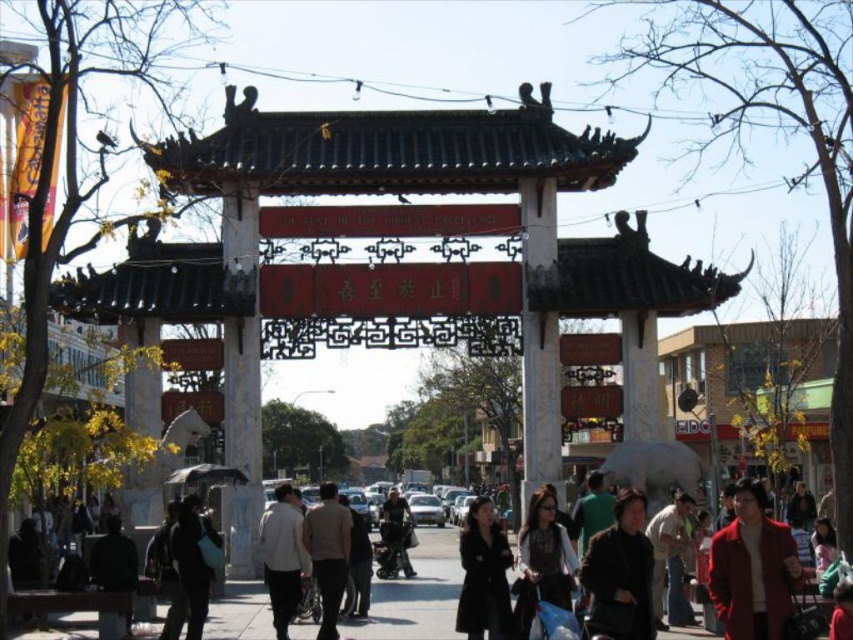
You are standing at the origin point of the scene. Where is the dark gray coat at center located in terms of coordinates?

The dark gray coat at center is located at coordinates point (189, 570).

You are a delivery person carrying a package and need to place it on the black matte coat at center. However, there is a dark gray fabric stroller at center in the way. Can you place the package on the coat without moving the stroller?

The black matte coat at center is located below the dark gray fabric stroller at center, so the stroller is blocking access to the coat. You cannot place the package on the coat without moving the stroller.

You are a pedestrian standing at the center of the street under the traditional Chinese archway. You see a black matte coat at center and a dark gray fabric stroller at center. Which object is positioned to the right side from your perspective?

The black matte coat at center is positioned to the right of the dark gray fabric stroller at center, so the black matte coat at center is on the right side.